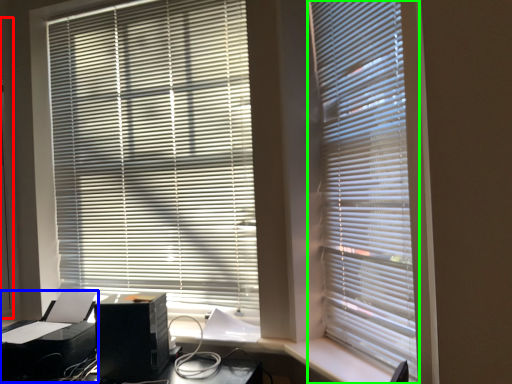
Question: Estimate the real-world distances between objects in this image. Which object is closer to screen door (highlighted by a red box), printer (highlighted by a blue box) or window blind (highlighted by a green box)?

Choices:
 (A) printer
 (B) window blind

Answer: (A)